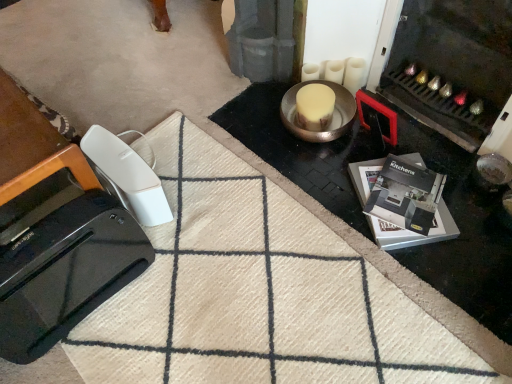
What are the coordinates of `vacant region in front of black glossy toaster at lower left, acting as the 2th home appliance starting from the back` in the screenshot? It's located at (93, 349).